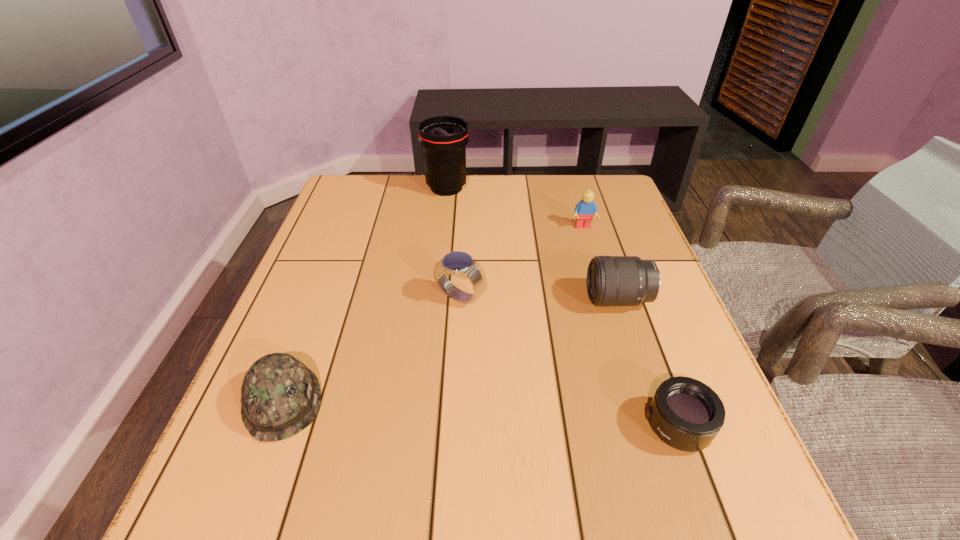
At what (x,y) coordinates should I click in order to perform the action: click on the leftmost telephoto lens. Please return your answer as a coordinate pair (x, y). Looking at the image, I should click on (444, 138).

Where is `the tallest telephoto lens`? The height and width of the screenshot is (540, 960). the tallest telephoto lens is located at coordinates (444, 138).

The width and height of the screenshot is (960, 540). I want to click on Lego, so click(x=584, y=210).

Image resolution: width=960 pixels, height=540 pixels. Identify the location of the second shortest telephoto lens. (611, 280).

Locate an element on the screen. Image resolution: width=960 pixels, height=540 pixels. watch is located at coordinates (455, 263).

This screenshot has height=540, width=960. In order to click on headwear in this screenshot , I will do `click(280, 396)`.

The width and height of the screenshot is (960, 540). I want to click on the leftmost object, so click(x=280, y=396).

Identify the location of the shortest object. The width and height of the screenshot is (960, 540). (686, 414).

The image size is (960, 540). What are the coordinates of `the shortest telephoto lens` in the screenshot? It's located at click(x=686, y=414).

This screenshot has width=960, height=540. I want to click on vacant region located on the left of the farthest telephoto lens, so click(367, 188).